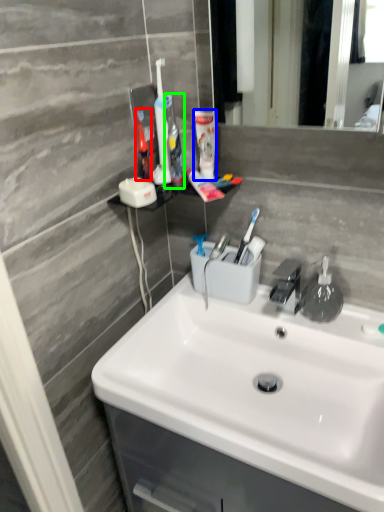
Question: Which is farther away from toothbrush (highlighted by a red box)? mouthwash (highlighted by a blue box) or toothbrush (highlighted by a green box)?

Choices:
 (A) mouthwash
 (B) toothbrush

Answer: (A)